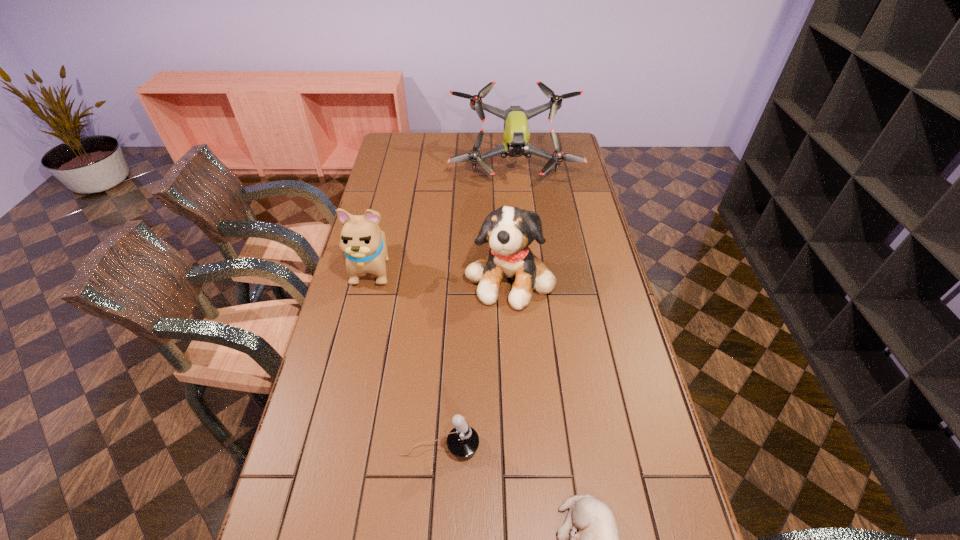
You are a GUI agent. You are given a task and a screenshot of the screen. Output one action in this format:
    pyautogui.click(x=<x>, y=<y>)
    Task: Click on the drone
    
    Given the screenshot: What is the action you would take?
    pos(516,135)

The height and width of the screenshot is (540, 960). In order to click on the leftmost object in this screenshot , I will do `click(364, 244)`.

You are a GUI agent. You are given a task and a screenshot of the screen. Output one action in this format:
    pyautogui.click(x=<x>, y=<y>)
    Task: Click on the second nearest object
    The height and width of the screenshot is (540, 960).
    Given the screenshot: What is the action you would take?
    pyautogui.click(x=463, y=441)

Identify the location of free spot located on the front-facing side of the drone. This screenshot has height=540, width=960. (521, 230).

At what (x,y) coordinates should I click in order to perform the action: click on free spot located on the face of the leftmost puppy. Please return your answer as a coordinate pair (x, y). Image resolution: width=960 pixels, height=540 pixels. Looking at the image, I should click on (348, 370).

I want to click on vacant space located on the right of the microphone, so click(x=586, y=446).

Locate an element on the screen. object that is at the far edge is located at coordinates (516, 135).

You are a GUI agent. You are given a task and a screenshot of the screen. Output one action in this format:
    pyautogui.click(x=<x>, y=<y>)
    Task: Click on the object at the left edge
    Image resolution: width=960 pixels, height=540 pixels.
    Given the screenshot: What is the action you would take?
    pyautogui.click(x=364, y=244)

Where is `object located at the right edge`? The image size is (960, 540). object located at the right edge is located at coordinates (516, 135).

Where is `object that is at the far right corner`? object that is at the far right corner is located at coordinates (516, 135).